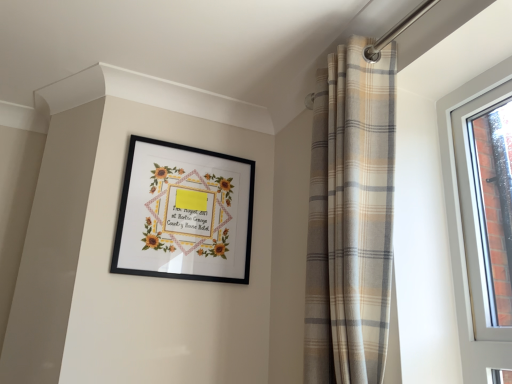
Measure the distance between black matte picture frame at upper center and camera.

black matte picture frame at upper center is 4.97 feet away from camera.

This screenshot has width=512, height=384. Identify the location of black matte picture frame at upper center. pyautogui.click(x=185, y=213).

Describe the element at coordinates (185, 213) in the screenshot. I see `black matte picture frame at upper center` at that location.

Identify the location of beige plaid curtain at upper right. This screenshot has height=384, width=512. (350, 218).

The image size is (512, 384). Describe the element at coordinates (350, 218) in the screenshot. I see `beige plaid curtain at upper right` at that location.

In order to click on black matte picture frame at upper center in this screenshot , I will do `click(185, 213)`.

Is beige plaid curtain at upper right to the right of black matte picture frame at upper center from the viewer's perspective?

Indeed, beige plaid curtain at upper right is positioned on the right side of black matte picture frame at upper center.

Is beige plaid curtain at upper right in front of or behind black matte picture frame at upper center in the image?

Clearly, beige plaid curtain at upper right is in front of black matte picture frame at upper center.

Does point (389, 111) appear closer or farther from the camera than point (188, 178)?

Point (389, 111).

From the image's perspective, is beige plaid curtain at upper right below black matte picture frame at upper center?

Incorrect, from the image's perspective, beige plaid curtain at upper right is higher than black matte picture frame at upper center.

From a real-world perspective, who is located higher, beige plaid curtain at upper right or black matte picture frame at upper center?

black matte picture frame at upper center.

Does beige plaid curtain at upper right have a lesser width compared to black matte picture frame at upper center?

No.

Considering the relative sizes of beige plaid curtain at upper right and black matte picture frame at upper center in the image provided, is beige plaid curtain at upper right shorter than black matte picture frame at upper center?

Incorrect, the height of beige plaid curtain at upper right does not fall short of that of black matte picture frame at upper center.

Is beige plaid curtain at upper right bigger than black matte picture frame at upper center?

Correct, beige plaid curtain at upper right is larger in size than black matte picture frame at upper center.

Choose the correct answer: Is beige plaid curtain at upper right inside black matte picture frame at upper center or outside it?

beige plaid curtain at upper right is not inside black matte picture frame at upper center, it's outside.

Does beige plaid curtain at upper right touch black matte picture frame at upper center?

beige plaid curtain at upper right and black matte picture frame at upper center are not in contact.

Looking at this image, could you tell me if beige plaid curtain at upper right is facing black matte picture frame at upper center?

No, beige plaid curtain at upper right is not oriented towards black matte picture frame at upper center.

Looking at this image, measure the distance from beige plaid curtain at upper right to black matte picture frame at upper center.

A distance of 25.49 inches exists between beige plaid curtain at upper right and black matte picture frame at upper center.

Find the location of `picture frame below the beige plaid curtain at upper right (from the image's perspective)`. picture frame below the beige plaid curtain at upper right (from the image's perspective) is located at coordinates (185, 213).

Between black matte picture frame at upper center and beige plaid curtain at upper right, which one appears on the left side from the viewer's perspective?

black matte picture frame at upper center.

Is black matte picture frame at upper center positioned behind beige plaid curtain at upper right?

Yes, it is behind beige plaid curtain at upper right.

Which is less distant, [209,166] or [367,283]?

Point [209,166] is farther from the camera than point [367,283].

From the image's perspective, which is above, black matte picture frame at upper center or beige plaid curtain at upper right?

beige plaid curtain at upper right, from the image's perspective.

Based on the photo, from a real-world perspective, who is located lower, black matte picture frame at upper center or beige plaid curtain at upper right?

In real-world perspective, beige plaid curtain at upper right is lower.

Which of these two, black matte picture frame at upper center or beige plaid curtain at upper right, is wider?

With larger width is beige plaid curtain at upper right.

Which of these two, black matte picture frame at upper center or beige plaid curtain at upper right, stands shorter?

Standing shorter between the two is black matte picture frame at upper center.

Can you confirm if black matte picture frame at upper center is bigger than beige plaid curtain at upper right?

No, black matte picture frame at upper center is not bigger than beige plaid curtain at upper right.

Is black matte picture frame at upper center spatially inside beige plaid curtain at upper right, or outside of it?

black matte picture frame at upper center is not inside beige plaid curtain at upper right, it's outside.

Is black matte picture frame at upper center not near beige plaid curtain at upper right?

No.

Is beige plaid curtain at upper right at the back of black matte picture frame at upper center?

No, black matte picture frame at upper center is not facing the opposite direction of beige plaid curtain at upper right.

How many degrees apart are the facing directions of black matte picture frame at upper center and beige plaid curtain at upper right?

88.6 degrees separate the facing orientations of black matte picture frame at upper center and beige plaid curtain at upper right.

The height and width of the screenshot is (384, 512). Identify the location of curtain located underneath the black matte picture frame at upper center (from a real-world perspective). (350, 218).

Image resolution: width=512 pixels, height=384 pixels. In order to click on curtain lying above the black matte picture frame at upper center (from the image's perspective) in this screenshot , I will do `click(350, 218)`.

Identify the location of picture frame above the beige plaid curtain at upper right (from a real-world perspective). Image resolution: width=512 pixels, height=384 pixels. (185, 213).